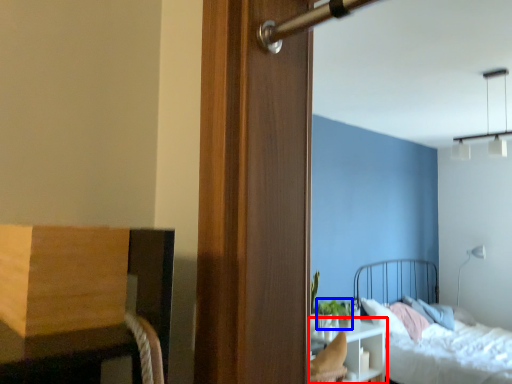
Question: Which of the following is the farthest to the observer, nightstand (highlighted by a red box) or plant (highlighted by a blue box)?

Choices:
 (A) nightstand
 (B) plant

Answer: (B)